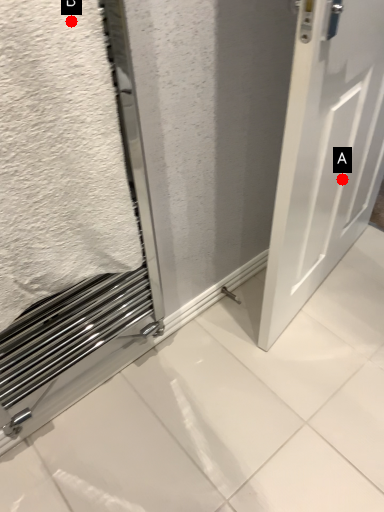
Question: Two points are circled on the image, labeled by A and B beside each circle. Which point appears closest to the camera in this image?

Choices:
 (A) A is closer
 (B) B is closer

Answer: (B)